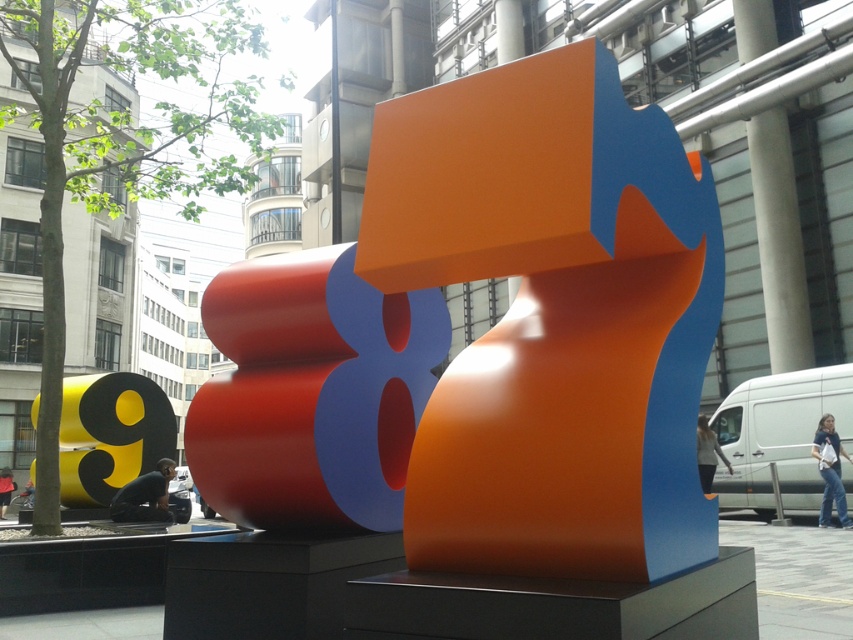
Does smooth concrete pillar at upper center appear on the left side of jeans at lower right?

No, smooth concrete pillar at upper center is not to the left of jeans at lower right.

Can you confirm if smooth concrete pillar at upper center is positioned above jeans at lower right?

Yes.

This screenshot has height=640, width=853. What do you see at coordinates (779, 241) in the screenshot?
I see `smooth concrete pillar at upper center` at bounding box center [779, 241].

You are a GUI agent. You are given a task and a screenshot of the screen. Output one action in this format:
    pyautogui.click(x=<x>, y=<y>)
    Task: Click on the smooth concrete pillar at upper center
    The height and width of the screenshot is (640, 853).
    Given the screenshot: What is the action you would take?
    pyautogui.click(x=779, y=241)

Can you confirm if orange glossy sculpture at center is thinner than matte orange number at center?

Incorrect, orange glossy sculpture at center's width is not less than matte orange number at center's.

Can you confirm if orange glossy sculpture at center is positioned above matte orange number at center?

Indeed, orange glossy sculpture at center is positioned over matte orange number at center.

What do you see at coordinates (553, 320) in the screenshot? I see `orange glossy sculpture at center` at bounding box center [553, 320].

Find the location of a particular element. orange glossy sculpture at center is located at coordinates (553, 320).

Which is above, jeans at lower right or dark blue jeans at lower center?

Positioned higher is jeans at lower right.

Does point (822, 518) come farther from viewer compared to point (9, 486)?

No, (822, 518) is closer to viewer.

Is point (827, 417) positioned in front of point (9, 477)?

Yes.

Locate an element on the screen. The image size is (853, 640). jeans at lower right is located at coordinates (830, 470).